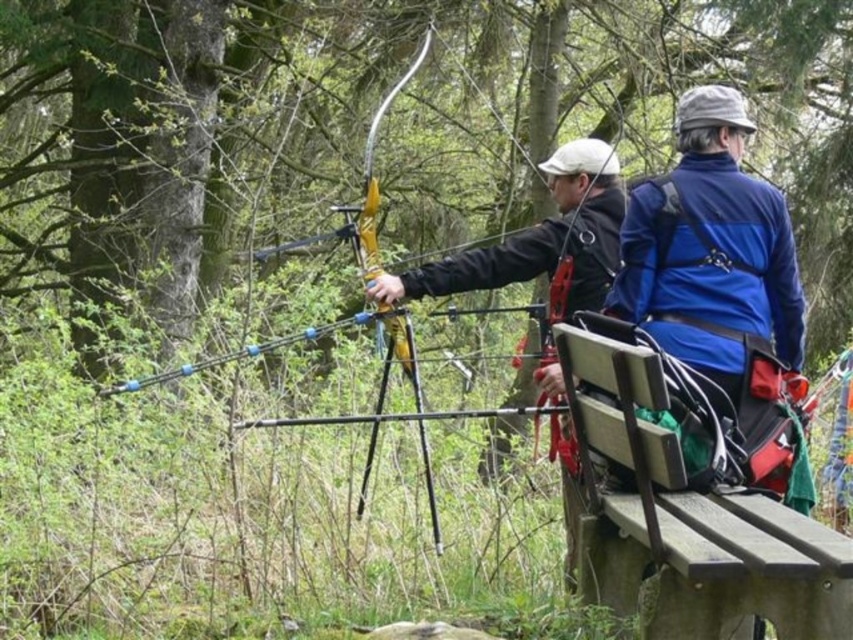
Question: Among these points, which one is nearest to the camera?

Choices:
 (A) (587, 170)
 (B) (625, 381)

Answer: (B)

Question: Which object appears closest to the camera in this image?

Choices:
 (A) matte black jacket at center
 (B) wooden park bench at center

Answer: (B)

Question: Can you confirm if wooden park bench at center is positioned below matte black jacket at center?

Choices:
 (A) no
 (B) yes

Answer: (B)

Question: Can you confirm if wooden park bench at center is positioned to the left of matte black jacket at center?

Choices:
 (A) yes
 (B) no

Answer: (B)

Question: Observing the image, what is the correct spatial positioning of wooden park bench at center in reference to matte black jacket at center?

Choices:
 (A) above
 (B) below

Answer: (B)

Question: Which object appears closest to the camera in this image?

Choices:
 (A) matte black jacket at center
 (B) wooden park bench at center

Answer: (B)